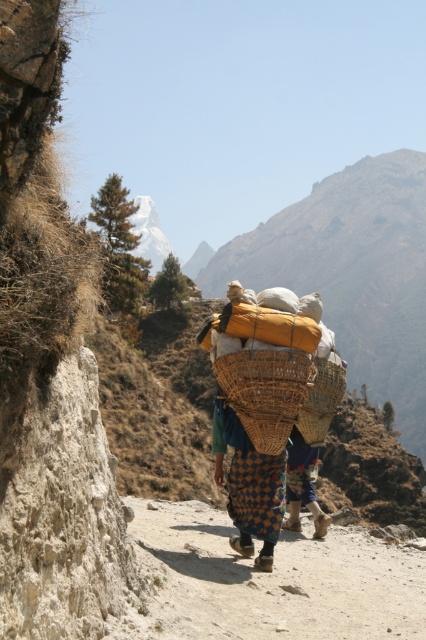
Question: Which object appears farthest from the camera in this image?

Choices:
 (A) woven brown basket at center
 (B) bright yellow woven basket at center
 (C) dusty gravel path at center

Answer: (A)

Question: Which point is farther to the camera?

Choices:
 (A) bright yellow woven basket at center
 (B) woven bamboo basket at center
 (C) dusty gravel path at center
 (D) blue woven pants at center

Answer: (D)

Question: Which is farther from the dusty gravel path at center?

Choices:
 (A) brown woven basket at center
 (B) bright yellow woven basket at center
 (C) woven brown basket at center

Answer: (C)

Question: From the image, what is the correct spatial relationship of dusty gravel path at center in relation to bright yellow woven basket at center?

Choices:
 (A) above
 (B) below

Answer: (B)

Question: Is rugged brown mountain at center closer to the viewer compared to bright yellow woven basket at center?

Choices:
 (A) yes
 (B) no

Answer: (B)

Question: Is woven brown basket at center bigger than blue woven pants at center?

Choices:
 (A) no
 (B) yes

Answer: (A)